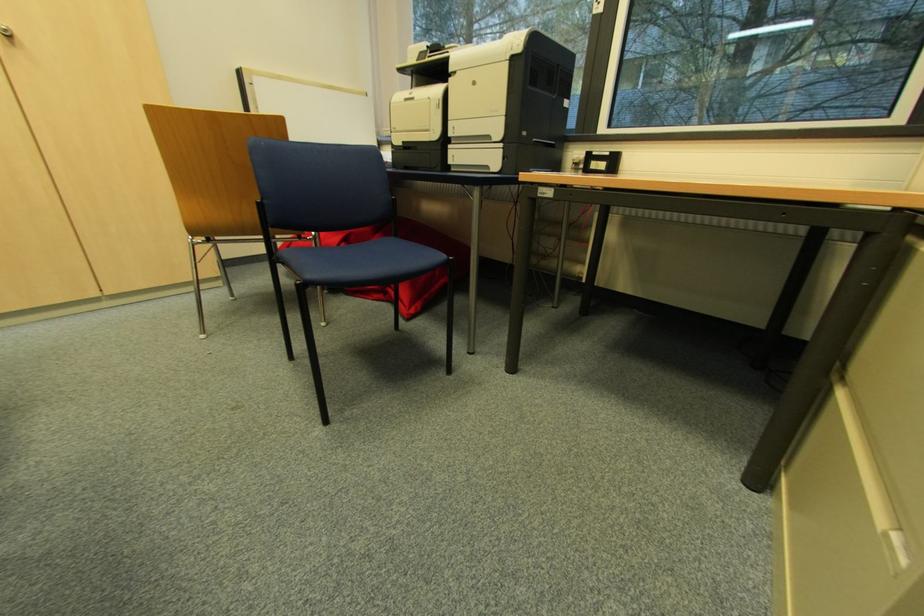
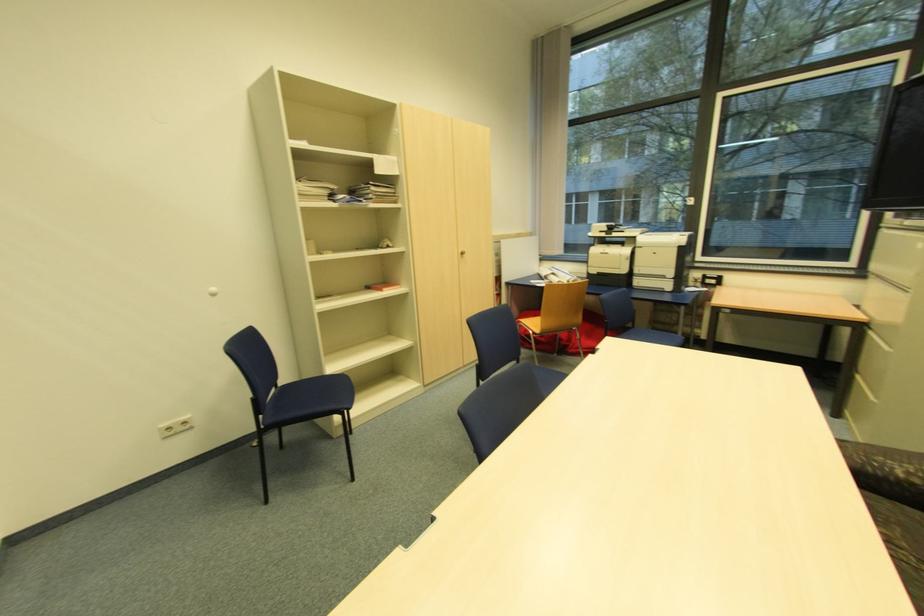
Looking at this image, in a continuous first-person perspective shot, in which direction is the camera moving?

The cameraman walked toward left, backward.